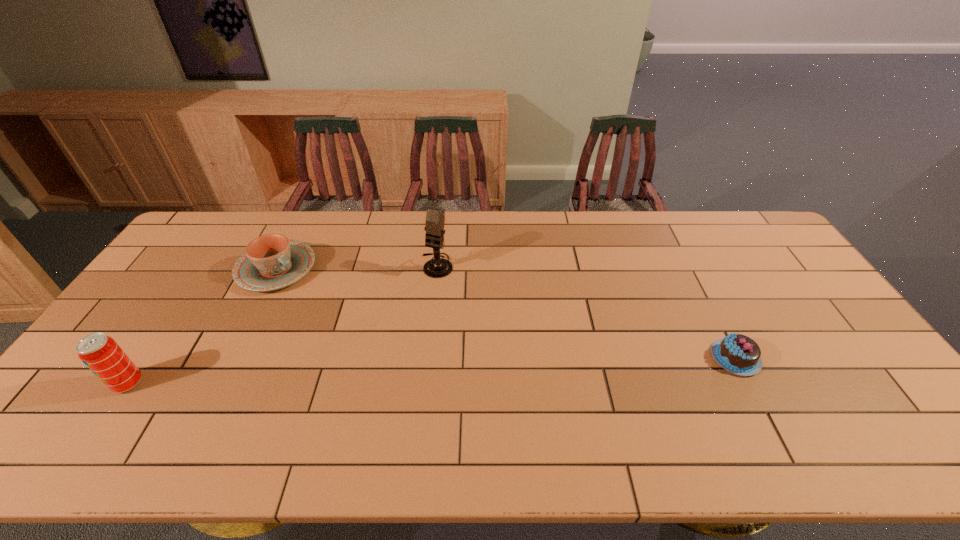
Identify the location of free space between the microphone and the chinaware. Image resolution: width=960 pixels, height=540 pixels. (357, 267).

The image size is (960, 540). I want to click on free space between the third object from right to left and the second object from right to left, so click(357, 267).

This screenshot has height=540, width=960. What are the coordinates of `vacant area between the tallest object and the shortest object` in the screenshot? It's located at (587, 312).

Locate an element on the screen. The image size is (960, 540). vacant area that lies between the shortest object and the third object from left to right is located at coordinates (587, 312).

In order to click on vacant region between the microphone and the third object from right to left in this screenshot , I will do `click(357, 267)`.

You are a GUI agent. You are given a task and a screenshot of the screen. Output one action in this format:
    pyautogui.click(x=<x>, y=<y>)
    Task: Click on the free point between the chinaware and the second tallest object
    The width and height of the screenshot is (960, 540).
    Given the screenshot: What is the action you would take?
    pyautogui.click(x=203, y=326)

Locate an element on the screen. free space between the soda can and the chinaware is located at coordinates (203, 326).

You are a GUI agent. You are given a task and a screenshot of the screen. Output one action in this format:
    pyautogui.click(x=<x>, y=<y>)
    Task: Click on the object that stands as the second closest to the tallest object
    
    Given the screenshot: What is the action you would take?
    pyautogui.click(x=739, y=354)

This screenshot has width=960, height=540. I want to click on object that is the third closest to the leftmost object, so click(x=739, y=354).

At what (x,y) coordinates should I click in order to perform the action: click on vacant region that satisfies the following two spatial constraints: 1. on the back side of the third tallest object; 2. on the left side of the microphone. Please return your answer as a coordinate pair (x, y). The height and width of the screenshot is (540, 960). Looking at the image, I should click on (278, 265).